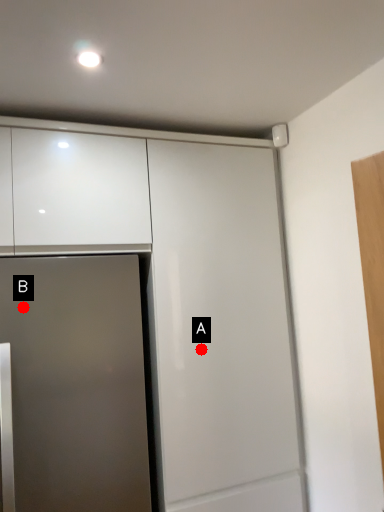
Question: Two points are circled on the image, labeled by A and B beside each circle. Among these points, which one is nearest to the camera?

Choices:
 (A) A is closer
 (B) B is closer

Answer: (B)